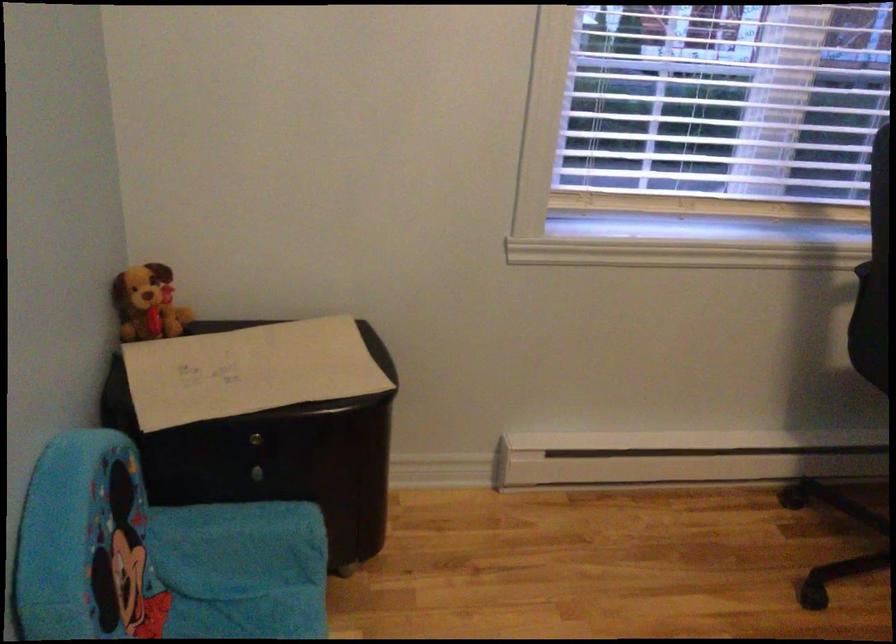
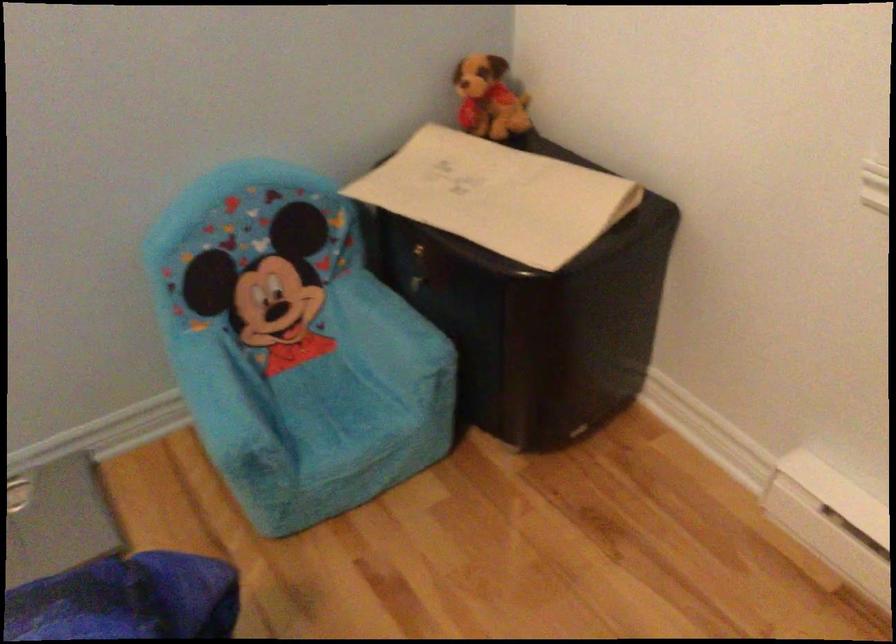
Find the pixel in the second image that matches point 167,301 in the first image.

(488, 99)